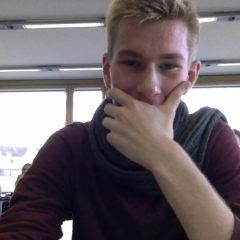
Where is `table`? The image size is (240, 240). table is located at coordinates (3, 201).